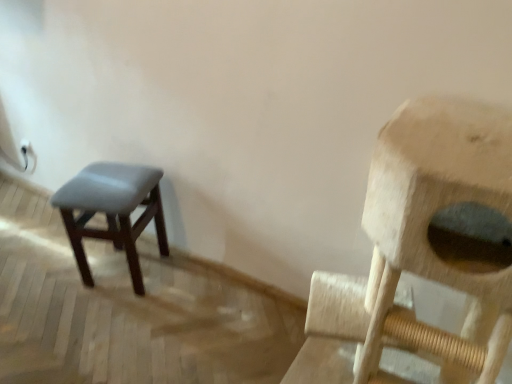
Find the location of a particular element. Image resolution: width=512 pixels, height=384 pixels. free space in front of matte gray stool at left is located at coordinates (105, 323).